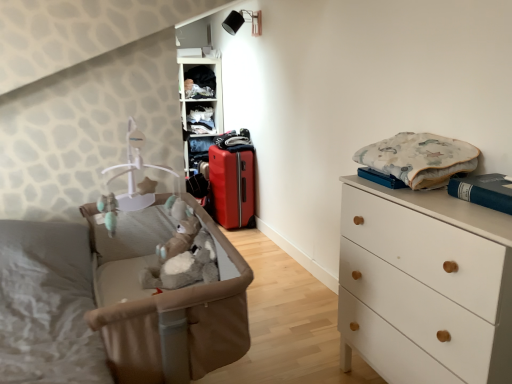
What do you see at coordinates (200, 118) in the screenshot? I see `matte plastic shelves at upper center, which is the second shelf from bottom to top` at bounding box center [200, 118].

This screenshot has height=384, width=512. Describe the element at coordinates (420, 158) in the screenshot. I see `fluffy cotton blanket at upper right, which is counted as the 2th clothing, starting from the back` at that location.

How much space does fluffy cotton blanket at upper right, the first clothing in the bottom-to-top sequence, occupy vertically?

The height of fluffy cotton blanket at upper right, the first clothing in the bottom-to-top sequence, is 7.70 inches.

Image resolution: width=512 pixels, height=384 pixels. What are the coordinates of `white matte chest of drawers at right` in the screenshot? It's located at (424, 286).

What do you see at coordinates (163, 293) in the screenshot? Image resolution: width=512 pixels, height=384 pixels. I see `brown fabric infant bed at left` at bounding box center [163, 293].

Where is `matte plastic shelves at upper center, which is the second shelf from bottom to top`? matte plastic shelves at upper center, which is the second shelf from bottom to top is located at coordinates (200, 118).

Measure the distance between brown fabric infant bed at left and fluffy cotton blanket at upper right, the first clothing in the bottom-to-top sequence.

A distance of 86.64 centimeters exists between brown fabric infant bed at left and fluffy cotton blanket at upper right, the first clothing in the bottom-to-top sequence.

Which object is wider, brown fabric infant bed at left or fluffy cotton blanket at upper right, positioned as the 1th clothing in front-to-back order?

Wider between the two is brown fabric infant bed at left.

Is point (85, 214) farther from camera compared to point (408, 148)?

Yes, point (85, 214) is farther from viewer.

Do you think fluffy cotton blanket at upper right, positioned as the 1th clothing in front-to-back order, is within matte plastic shelf at upper center, the 1th shelf positioned from the bottom, or outside of it?

fluffy cotton blanket at upper right, positioned as the 1th clothing in front-to-back order, exists outside the volume of matte plastic shelf at upper center, the 1th shelf positioned from the bottom.

From a real-world perspective, which object stands above the other?

fluffy cotton blanket at upper right, the first clothing in the bottom-to-top sequence, from a real-world perspective.

Which is more to the right, fluffy cotton blanket at upper right, positioned as the 1th clothing in front-to-back order, or matte plastic shelf at upper center, which is the second shelf in top-to-bottom order?

From the viewer's perspective, fluffy cotton blanket at upper right, positioned as the 1th clothing in front-to-back order, appears more on the right side.

Are fluffy cotton blanket at upper right, the 2th clothing in the left-to-right sequence, and matte plastic shelf at upper center, which is the second shelf in top-to-bottom order, making contact?

No.

Considering the sizes of objects white matte chest of drawers at right and brown fabric infant bed at left in the image provided, who is thinner, white matte chest of drawers at right or brown fabric infant bed at left?

Thinner between the two is white matte chest of drawers at right.

Looking at this image, which object is positioned more to the right, white matte chest of drawers at right or brown fabric infant bed at left?

Positioned to the right is white matte chest of drawers at right.

Is white matte chest of drawers at right further to camera compared to brown fabric infant bed at left?

No.

Which object is thinner, brown fabric infant bed at left or dark blue fabric at upper center, the 1th clothing positioned from the top?

Thinner between the two is dark blue fabric at upper center, the 1th clothing positioned from the top.

From a real-world perspective, which is physically below, brown fabric infant bed at left or dark blue fabric at upper center, which is counted as the first clothing, starting from the back?

brown fabric infant bed at left.

Considering the positions of objects brown fabric infant bed at left and dark blue fabric at upper center, which ranks as the 1th clothing in left-to-right order, in the image provided, who is more to the right, brown fabric infant bed at left or dark blue fabric at upper center, which ranks as the 1th clothing in left-to-right order,?

Positioned to the right is brown fabric infant bed at left.

How distant is brown fabric infant bed at left from dark blue fabric at upper center, the 2th clothing in the bottom-to-top sequence?

A distance of 9.34 feet exists between brown fabric infant bed at left and dark blue fabric at upper center, the 2th clothing in the bottom-to-top sequence.

Which object is positioned more to the left, fluffy cotton blanket at upper right, the first clothing in the bottom-to-top sequence, or matte red suitcase at center?

matte red suitcase at center is more to the left.

From a real-world perspective, is fluffy cotton blanket at upper right, which is counted as the 2th clothing, starting from the back, beneath matte red suitcase at center?

Actually, fluffy cotton blanket at upper right, which is counted as the 2th clothing, starting from the back, is physically above matte red suitcase at center in the real world.

Is fluffy cotton blanket at upper right, the 2th clothing in the left-to-right sequence, in front of or behind matte red suitcase at center in the image?

fluffy cotton blanket at upper right, the 2th clothing in the left-to-right sequence, is in front of matte red suitcase at center.

From a real-world perspective, is white matte chest of drawers at right positioned over matte plastic shelves at upper center, which is the second shelf from bottom to top, based on gravity?

No, from a real-world perspective, white matte chest of drawers at right is not over matte plastic shelves at upper center, which is the second shelf from bottom to top

From the image's perspective, is white matte chest of drawers at right above or below matte plastic shelves at upper center, the 1th shelf positioned from the top?

Clearly, from the image's perspective, white matte chest of drawers at right is below matte plastic shelves at upper center, the 1th shelf positioned from the top.

From their relative heights in the image, would you say white matte chest of drawers at right is taller or shorter than matte plastic shelves at upper center, the 1th shelf positioned from the top?

Clearly, white matte chest of drawers at right is taller compared to matte plastic shelves at upper center, the 1th shelf positioned from the top.

Is matte plastic shelves at upper center, the 1th shelf positioned from the top, aimed at dark blue fabric at upper center, the 2th clothing in the bottom-to-top sequence?

No, matte plastic shelves at upper center, the 1th shelf positioned from the top, is not turned towards dark blue fabric at upper center, the 2th clothing in the bottom-to-top sequence.

Looking at this image, from a real-world perspective, does matte plastic shelves at upper center, the 1th shelf positioned from the top, sit lower than dark blue fabric at upper center, the 2th clothing in the bottom-to-top sequence?

Correct, in the physical world, matte plastic shelves at upper center, the 1th shelf positioned from the top, is lower than dark blue fabric at upper center, the 2th clothing in the bottom-to-top sequence.

From the image's perspective, is matte plastic shelves at upper center, which is the second shelf from bottom to top, located above dark blue fabric at upper center, the 2th clothing in the bottom-to-top sequence?

A: No, from the image's perspective, matte plastic shelves at upper center, which is the second shelf from bottom to top, is not on top of dark blue fabric at upper center, the 2th clothing in the bottom-to-top sequence.

Identify the location of infant bed located below the fluffy cotton blanket at upper right, the first clothing in the bottom-to-top sequence (from the image's perspective). (163, 293).

Starting from the fluffy cotton blanket at upper right, which ranks as the 1th clothing in right-to-left order, which shelf is the 2nd one to the left? Please provide its 2D coordinates.

[(200, 111)]

Which object lies further to the anchor point matte red suitcase at center, white matte chest of drawers at right or brown fabric infant bed at left?

white matte chest of drawers at right lies further to matte red suitcase at center than the other object.

When comparing their distances from matte red suitcase at center, does white matte chest of drawers at right or fluffy cotton blanket at upper right, which ranks as the 1th clothing in right-to-left order, seem closer?

Based on the image, fluffy cotton blanket at upper right, which ranks as the 1th clothing in right-to-left order, appears to be nearer to matte red suitcase at center.

Considering their positions, is matte plastic shelves at upper center, the 1th shelf positioned from the top, positioned closer to fluffy cotton blanket at upper right, positioned as the 1th clothing in front-to-back order, than brown fabric infant bed at left?

brown fabric infant bed at left is positioned closer to the anchor fluffy cotton blanket at upper right, positioned as the 1th clothing in front-to-back order.

From the image, which object appears to be nearer to matte red suitcase at center, matte plastic shelf at upper center, which is the second shelf in top-to-bottom order, or dark blue fabric at upper center, acting as the second clothing starting from the right?

The object closer to matte red suitcase at center is matte plastic shelf at upper center, which is the second shelf in top-to-bottom order.

Considering their positions, is matte red suitcase at center positioned further to matte plastic shelves at upper center, the 1th shelf positioned from the top, than matte plastic shelf at upper center, the 1th shelf positioned from the bottom?

Among the two, matte red suitcase at center is located further to matte plastic shelves at upper center, the 1th shelf positioned from the top.

Which object lies further to the anchor point matte red suitcase at center, dark blue fabric at upper center, which is counted as the first clothing, starting from the back, or white matte chest of drawers at right?

white matte chest of drawers at right.

When comparing their distances from dark blue fabric at upper center, which is counted as the first clothing, starting from the back, does fluffy cotton blanket at upper right, positioned as the 1th clothing in front-to-back order, or matte plastic shelf at upper center, the 1th shelf positioned from the bottom, seem further?

fluffy cotton blanket at upper right, positioned as the 1th clothing in front-to-back order, is further to dark blue fabric at upper center, which is counted as the first clothing, starting from the back.

Based on their spatial positions, is white matte chest of drawers at right or dark blue fabric at upper center, the 1th clothing positioned from the top, further from matte plastic shelf at upper center, the 1th shelf positioned from the bottom?

Among the two, white matte chest of drawers at right is located further to matte plastic shelf at upper center, the 1th shelf positioned from the bottom.

Find the location of a particular element. This screenshot has width=512, height=384. shelf between brown fabric infant bed at left and dark blue fabric at upper center, the 1th clothing positioned from the top, from front to back is located at coordinates (200, 111).

Identify the location of infant bed between white matte chest of drawers at right and dark blue fabric at upper center, the 2th clothing in the bottom-to-top sequence, along the z-axis. (163, 293).

Locate an element on the screen. This screenshot has height=384, width=512. shelf between white matte chest of drawers at right and matte plastic shelves at upper center, the 1th shelf positioned from the top, from front to back is located at coordinates (200, 111).

You are a GUI agent. You are given a task and a screenshot of the screen. Output one action in this format:
    pyautogui.click(x=<x>, y=<y>)
    Task: Click on the infant bed between white matte chest of drawers at right and matte plastic shelf at upper center, the 1th shelf positioned from the bottom, from front to back
    Image resolution: width=512 pixels, height=384 pixels.
    Given the screenshot: What is the action you would take?
    (x=163, y=293)